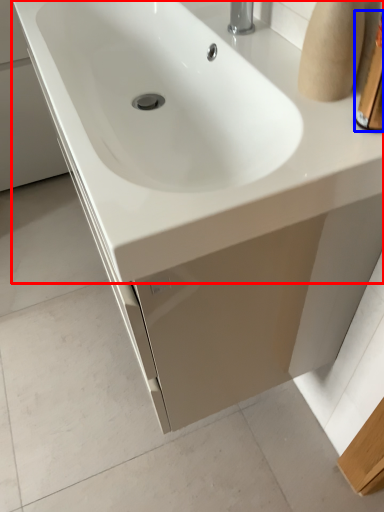
Question: Which point is further to the camera, sink (highlighted by a red box) or toiletry (highlighted by a blue box)?

Choices:
 (A) sink
 (B) toiletry

Answer: (A)